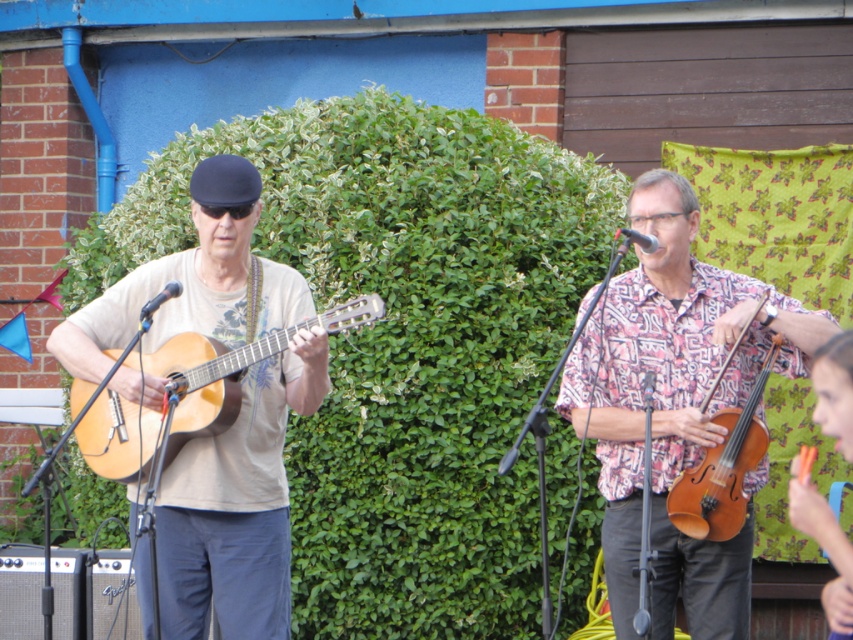
Question: Which of the following is the farthest from the observer?

Choices:
 (A) (207, 404)
 (B) (665, 225)
 (C) (218, 451)
 (D) (729, 538)

Answer: (B)

Question: In this image, where is matte brown guitar at left located relative to light brown acoustic guitar at left?

Choices:
 (A) right
 (B) left

Answer: (A)

Question: Does matte brown guitar at left appear on the left side of brown wooden violin at center-right?

Choices:
 (A) yes
 (B) no

Answer: (A)

Question: From the image, what is the correct spatial relationship of patterned fabric shirt at right in relation to light brown acoustic guitar at left?

Choices:
 (A) left
 (B) right

Answer: (B)

Question: Which object appears farthest from the camera in this image?

Choices:
 (A) light brown acoustic guitar at left
 (B) brown wooden violin at center-right

Answer: (B)

Question: Which point is closer to the camera?

Choices:
 (A) patterned fabric shirt at right
 (B) light brown acoustic guitar at left
 (C) matte brown guitar at left
 (D) brown wooden violin at center-right

Answer: (B)